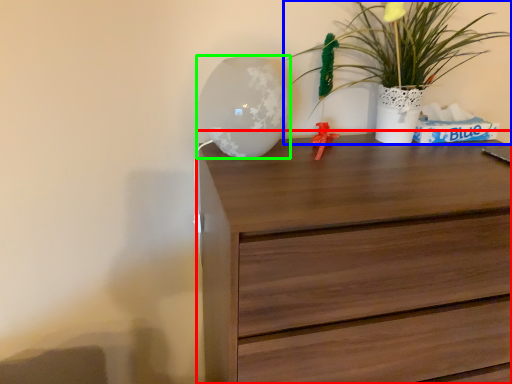
Question: Estimate the real-world distances between objects in this image. Which object is farther from chest of drawers (highlighted by a red box), houseplant (highlighted by a blue box) or table lamp (highlighted by a green box)?

Choices:
 (A) houseplant
 (B) table lamp

Answer: (A)